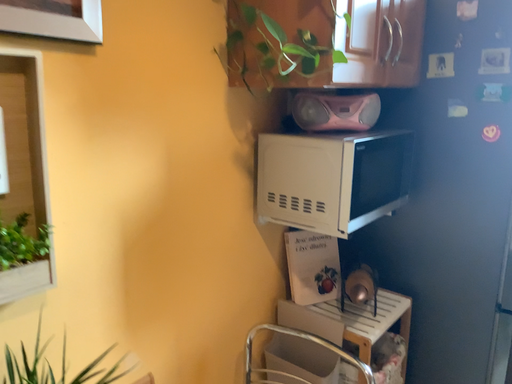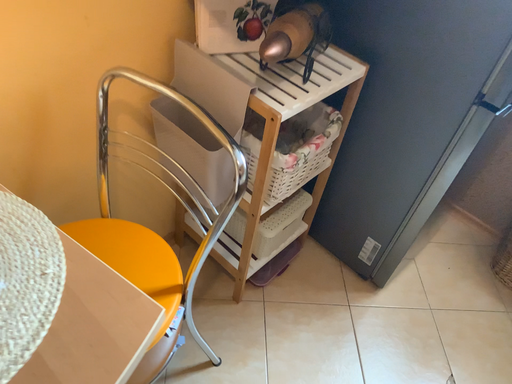
Question: Which way did the camera rotate in the video?

Choices:
 (A) rotated downward
 (B) rotated upward

Answer: (A)